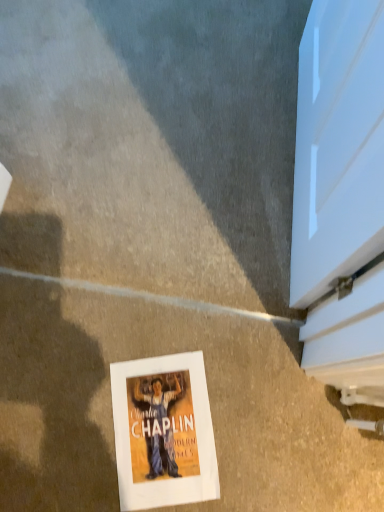
This screenshot has width=384, height=512. Describe the element at coordinates (163, 432) in the screenshot. I see `white paper at lower center` at that location.

This screenshot has height=512, width=384. Identify the location of white paper at lower center. (163, 432).

This screenshot has height=512, width=384. I want to click on white paper at lower center, so click(x=163, y=432).